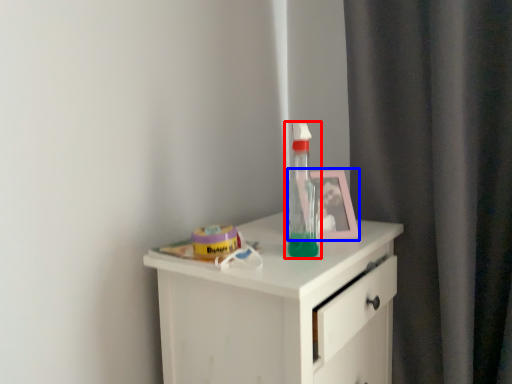
Question: Which object is closer to the camera taking this photo, bottle (highlighted by a red box) or picture frame (highlighted by a blue box)?

Choices:
 (A) bottle
 (B) picture frame

Answer: (A)